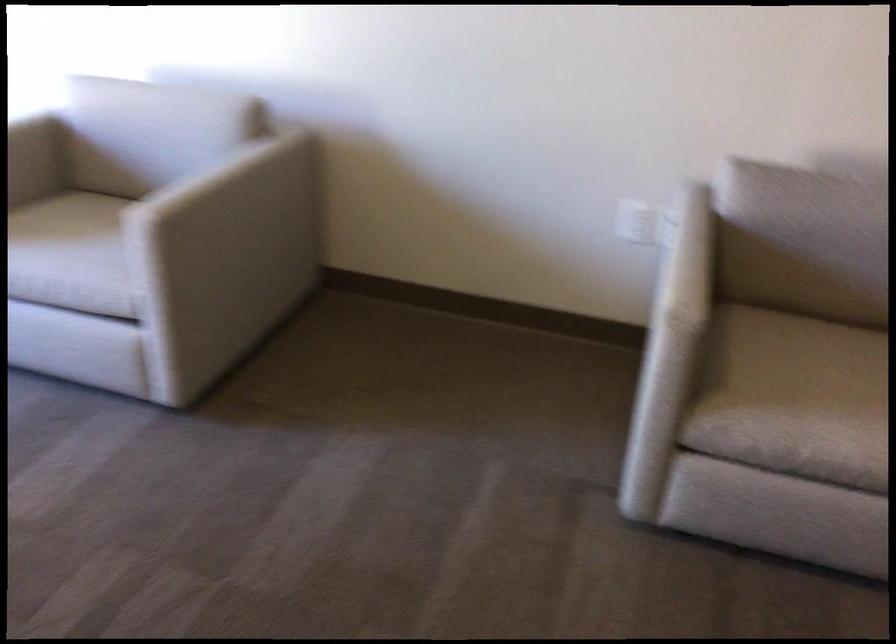
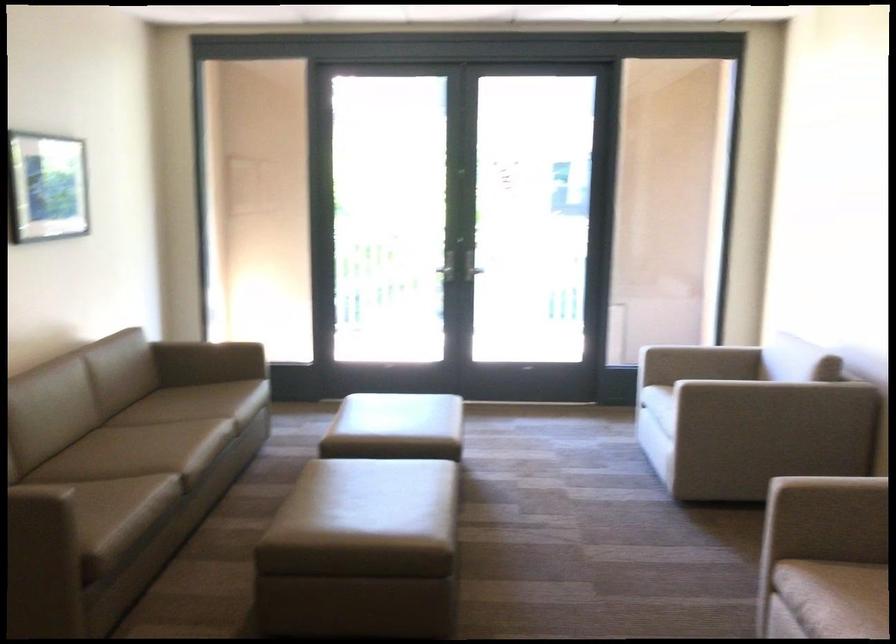
In the second image, find the point that corresponds to (x=115, y=98) in the first image.

(762, 346)